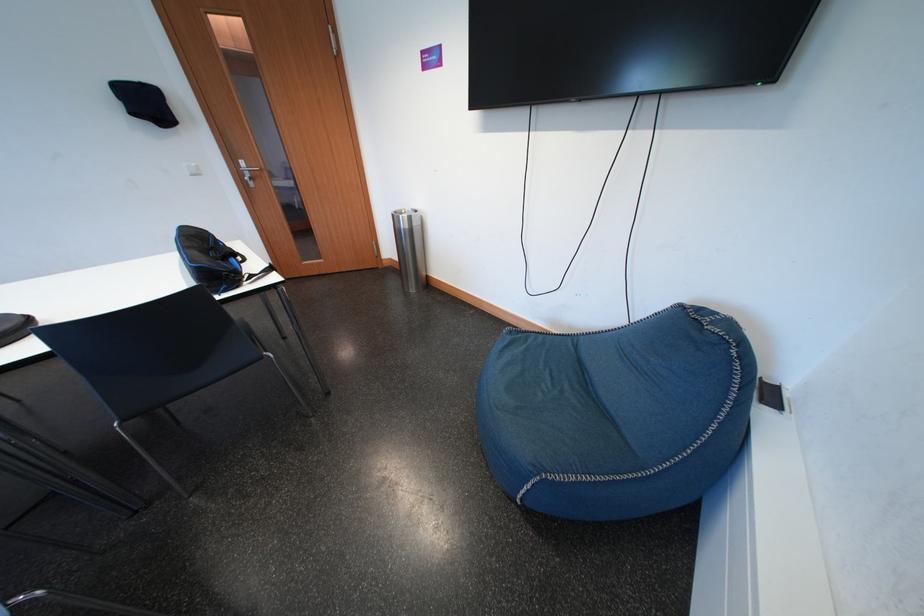
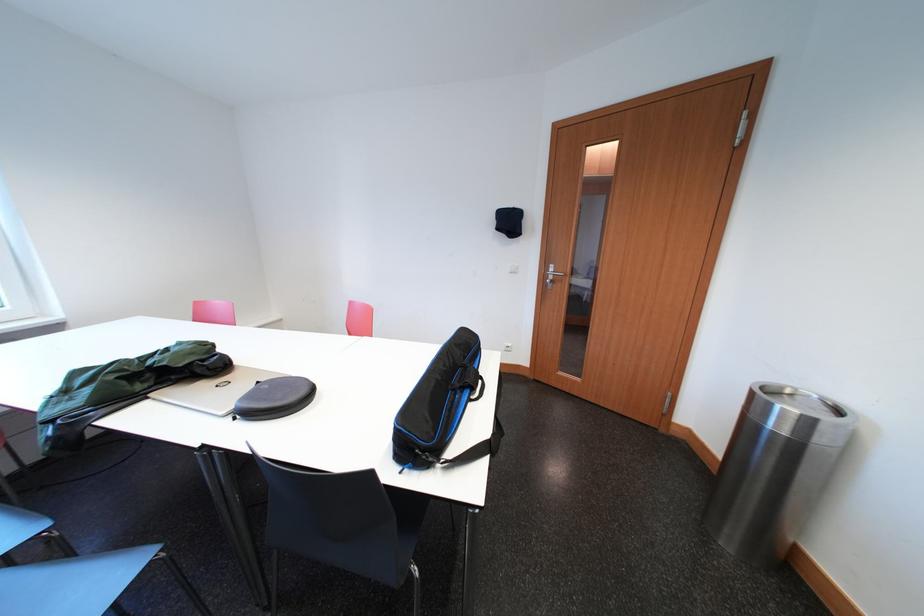
Question: The camera is either moving clockwise (left) or counter-clockwise (right) around the object. The first image is from the beginning of the video and the second image is from the end. Is the camera moving left or right when shooting the video?

Choices:
 (A) Left
 (B) Right

Answer: (B)